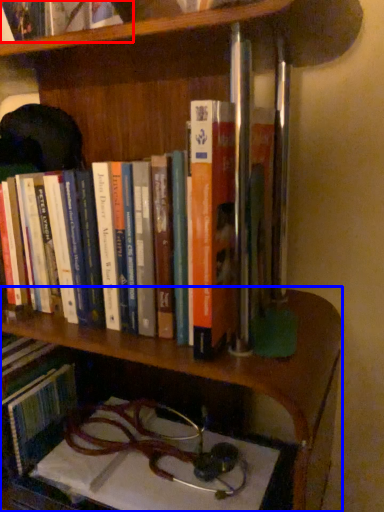
Question: Which object is further to the camera taking this photo, book (highlighted by a red box) or shelf (highlighted by a blue box)?

Choices:
 (A) book
 (B) shelf

Answer: (B)